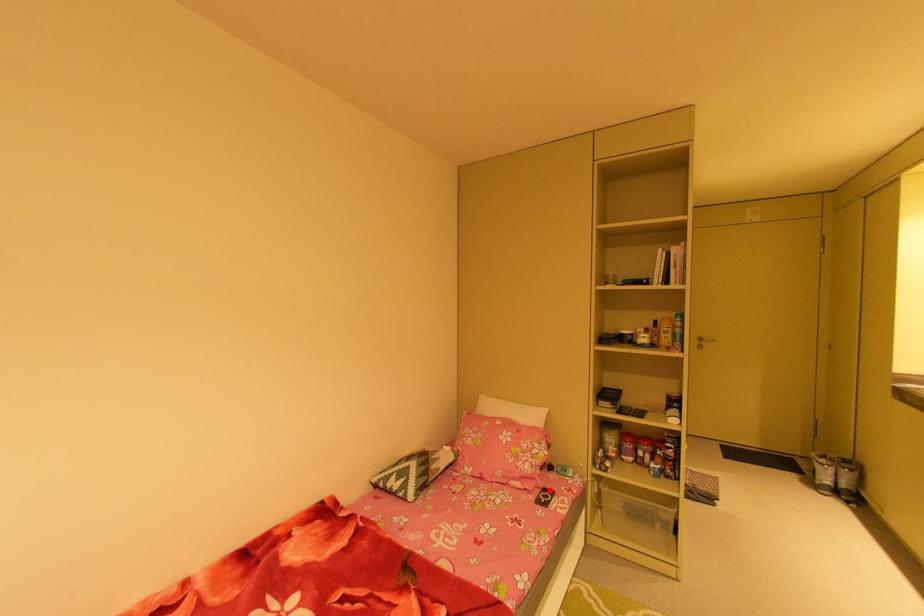
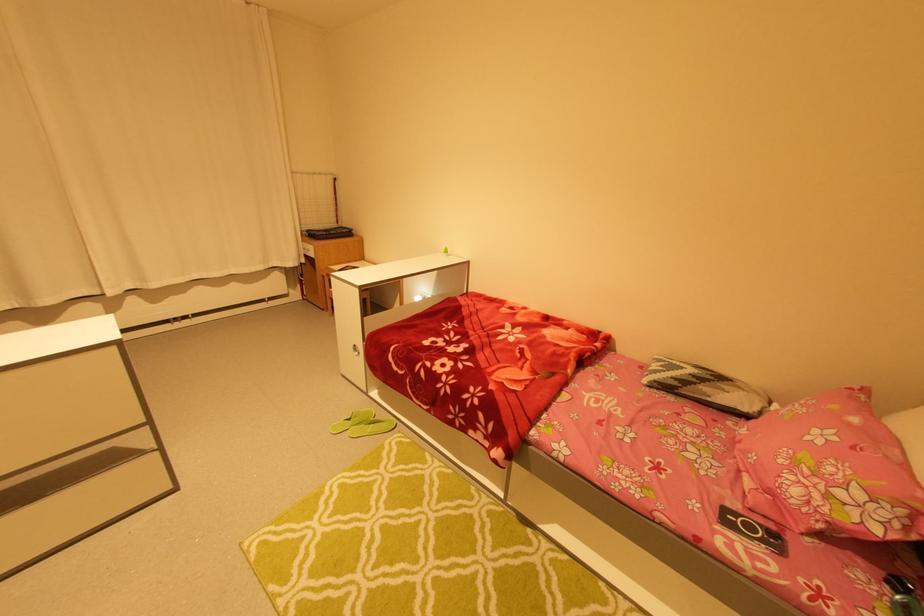
Question: I am providing you with two images of the same scene from different viewpoints. A red point is shown in image1. For the corresponding object point in image2, is it positioned nearer or farther from the camera?

Choices:
 (A) Nearer
 (B) Farther

Answer: (A)